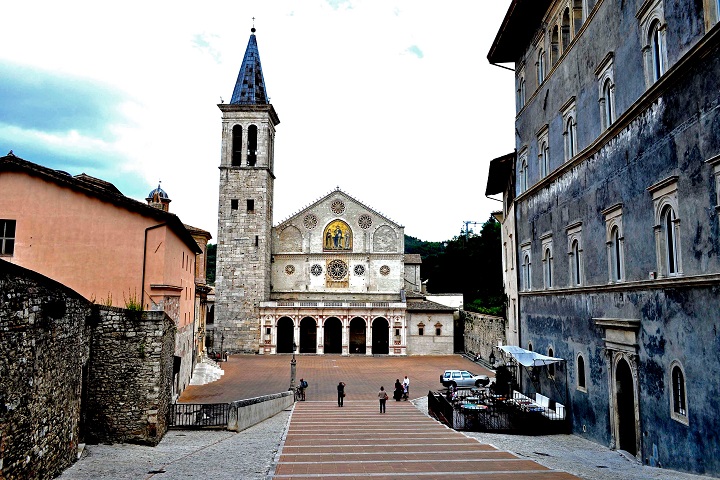
At what (x,y) coordinates should I click in order to perform the action: click on 1 area of table. Please return your answer as a coordinate pair (x, y). Looking at the image, I should click on (472, 416).